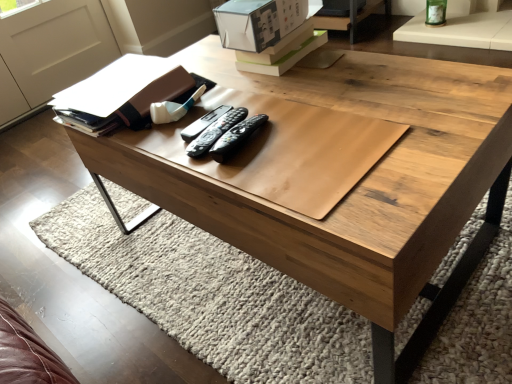
This screenshot has width=512, height=384. Find the location of `vacant space to the right of black plastic remote at center, marked as the 2th remote in a right-to-left arrangement`. vacant space to the right of black plastic remote at center, marked as the 2th remote in a right-to-left arrangement is located at coordinates (302, 124).